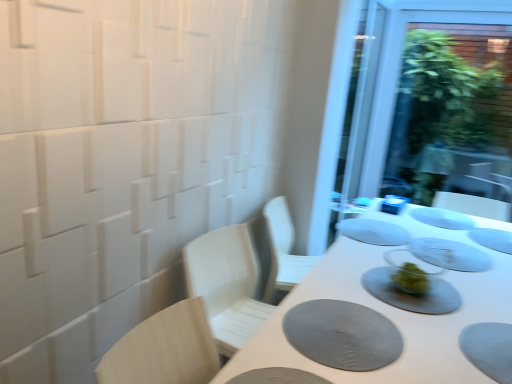
I want to click on unoccupied space behind matte gray placemat at center, the first tableware in the front-to-back sequence, so click(376, 253).